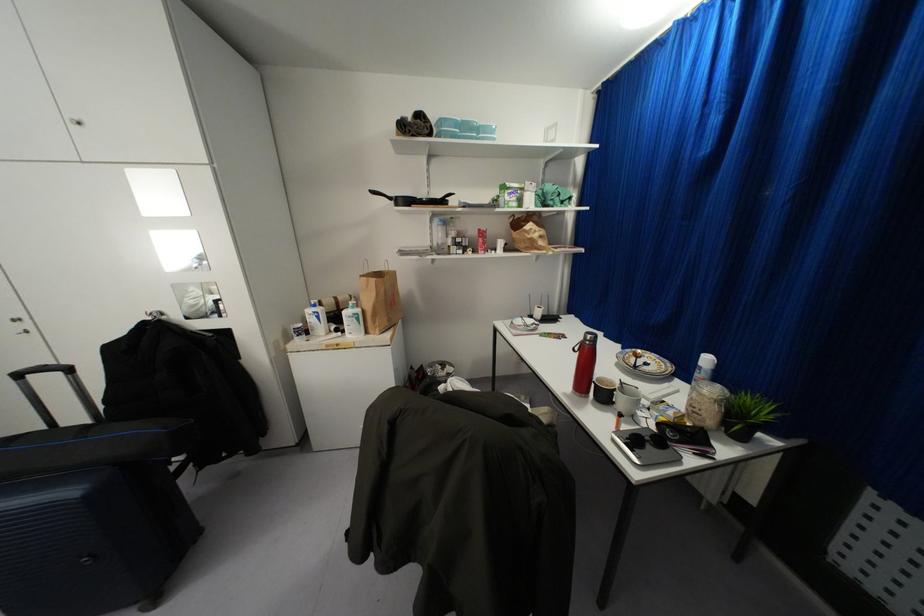
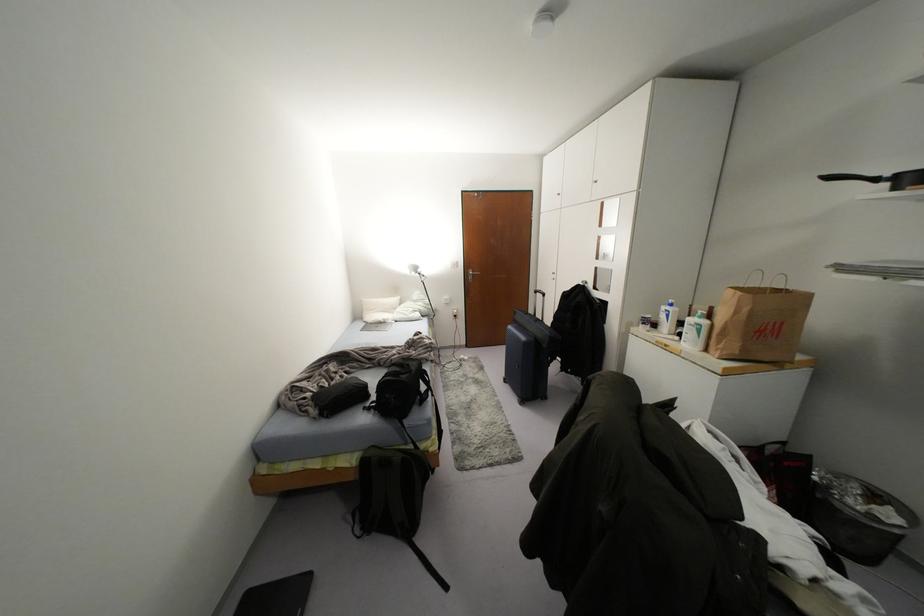
Where in the second image is the point corresponding to point (358, 310) from the first image?

(703, 322)